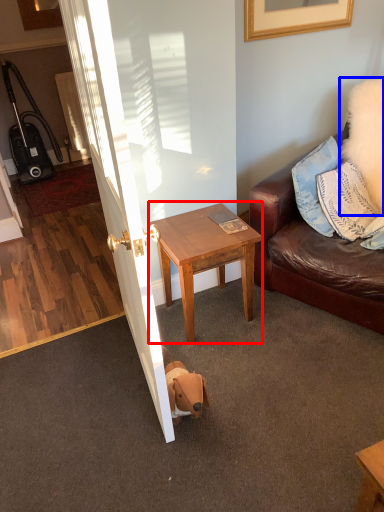
Question: Which object is further to the camera taking this photo, table (highlighted by a red box) or pillow (highlighted by a blue box)?

Choices:
 (A) table
 (B) pillow

Answer: (B)